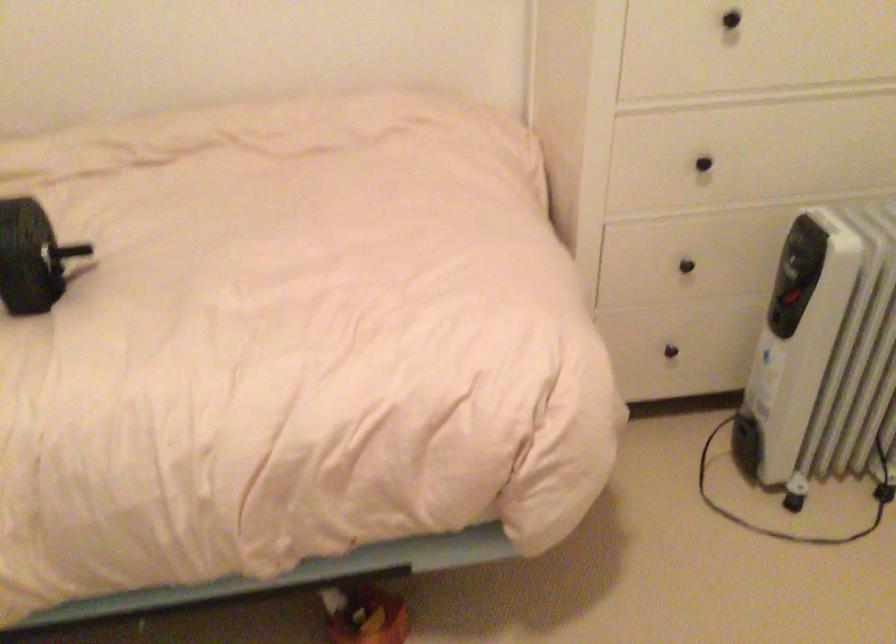
Identify the location of red heater button. The image size is (896, 644). (364, 614).